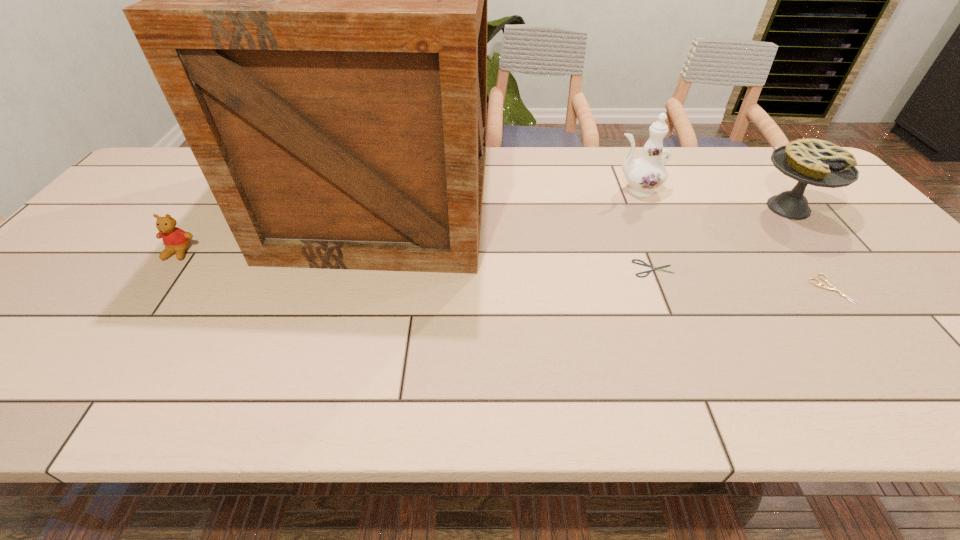
You are a GUI agent. You are given a task and a screenshot of the screen. Output one action in this format:
    pyautogui.click(x=<x>, y=<y>)
    Task: Click on the free space located on the front of the box
    
    Given the screenshot: What is the action you would take?
    pyautogui.click(x=344, y=361)

What are the coordinates of `free space located 0.370m at the spout of the fifth shortest object` in the screenshot? It's located at (487, 190).

In order to click on free space located 0.100m at the spout of the fifth shortest object in this screenshot , I will do `click(577, 190)`.

Where is `vacant space located at the spout of the fifth shortest object`? The height and width of the screenshot is (540, 960). vacant space located at the spout of the fifth shortest object is located at coordinates (561, 190).

I want to click on free space located on the cut side of the pie, so click(817, 243).

I want to click on free location located on the front-facing side of the teddy bear, so click(x=92, y=373).

Where is `vacant space located on the back of the taller shears`? The width and height of the screenshot is (960, 540). vacant space located on the back of the taller shears is located at coordinates (762, 201).

Find the location of `free space located on the left of the left shears`. free space located on the left of the left shears is located at coordinates (498, 268).

You are a GUI agent. You are given a task and a screenshot of the screen. Output one action in this format:
    pyautogui.click(x=<x>, y=<y>)
    Task: Click on the box that is at the far edge
    The height and width of the screenshot is (540, 960).
    Given the screenshot: What is the action you would take?
    pyautogui.click(x=314, y=0)

Locate an element on the screen. This screenshot has height=540, width=960. chinaware that is at the far edge is located at coordinates (645, 174).